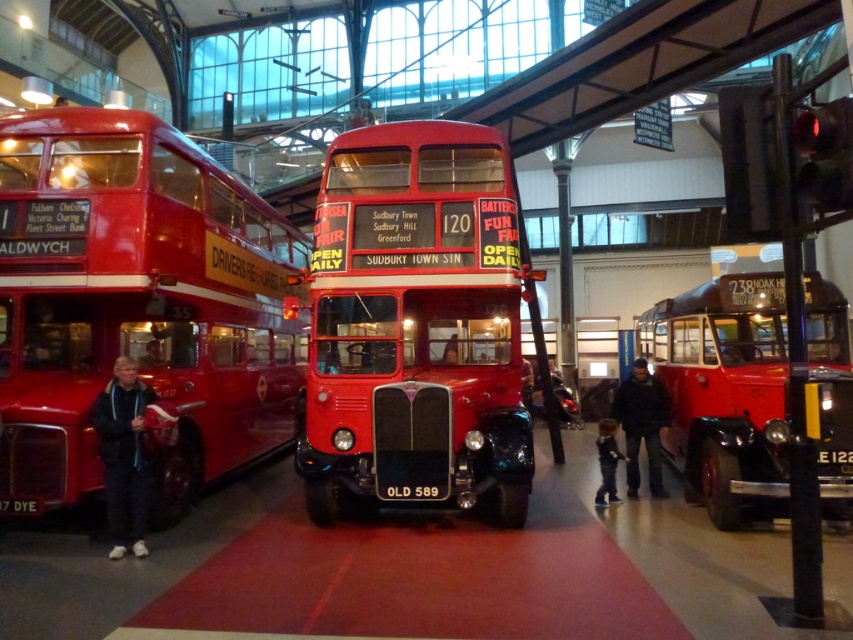
You are a tour guide standing in the museum and need to describe the items at the center of the scene. Which item is wider, the dark blue jacket at center or the black plastic license plate at center?

The dark blue jacket at center is wider than the black plastic license plate at center.

You are standing in the museum and want to take a photo of both point (635, 456) and point (430, 497). Since you can only focus on one point at a time, which point should you focus on first to ensure the other is still in focus?

You should focus on point (635, 456) first because it is further away from you than point (430, 497). By focusing on the further point, the closer point will still be within the depth of field.